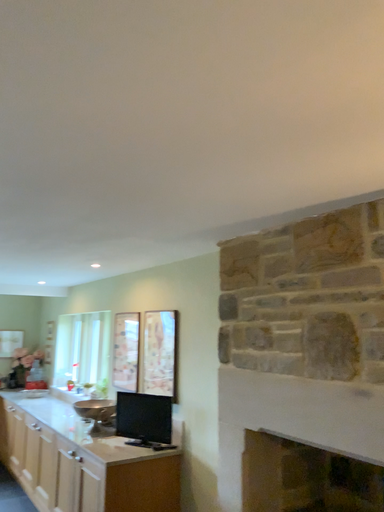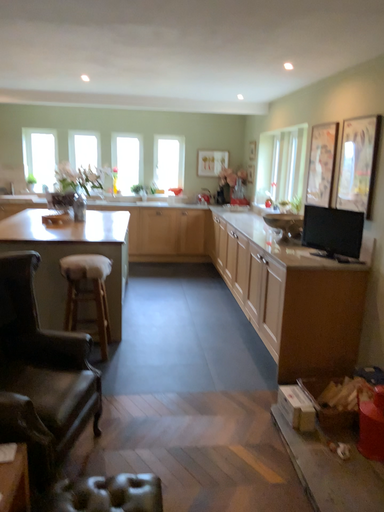
Question: How did the camera likely rotate when shooting the video?

Choices:
 (A) rotated downward
 (B) rotated upward

Answer: (A)